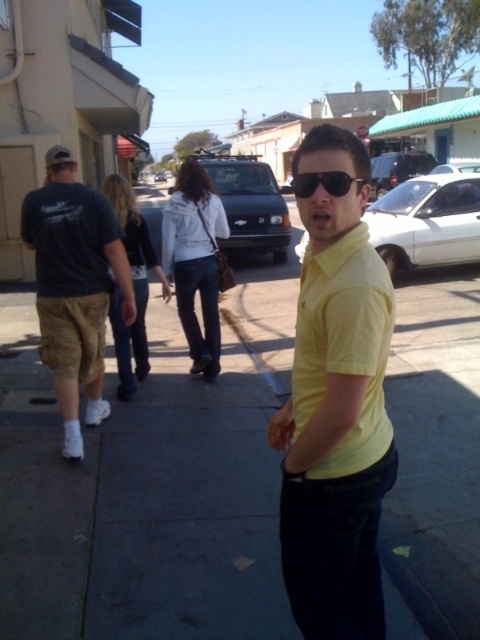
Does gray concrete sidewalk at center have a greater width compared to yellow matte shirt at center?

Indeed, gray concrete sidewalk at center has a greater width compared to yellow matte shirt at center.

Who is more forward, (x=109, y=500) or (x=284, y=406)?

Positioned in front is point (x=284, y=406).

You are a GUI agent. You are given a task and a screenshot of the screen. Output one action in this format:
    pyautogui.click(x=<x>, y=<y>)
    Task: Click on the gray concrete sidewalk at center
    The height and width of the screenshot is (640, 480).
    Given the screenshot: What is the action you would take?
    pyautogui.click(x=149, y=483)

Is gray concrete sidewalk at center smaller than dark blue t-shirt at left?

Yes, gray concrete sidewalk at center is smaller than dark blue t-shirt at left.

Does gray concrete sidewalk at center appear on the right side of dark blue t-shirt at left?

Correct, you'll find gray concrete sidewalk at center to the right of dark blue t-shirt at left.

Between point (456, 608) and point (33, 218), which one is positioned in front?

Point (456, 608) is in front.

At what (x,y) coordinates should I click in order to perform the action: click on gray concrete sidewalk at center. Please return your answer as a coordinate pair (x, y). This screenshot has height=640, width=480. Looking at the image, I should click on (149, 483).

Which is behind, point (335, 554) or point (62, 164)?

Positioned behind is point (62, 164).

Does yellow matte shirt at center have a lesser width compared to dark blue t-shirt at left?

Yes, yellow matte shirt at center is thinner than dark blue t-shirt at left.

Which is in front, point (320, 168) or point (121, 260)?

Positioned in front is point (320, 168).

Locate an element on the screen. This screenshot has width=480, height=640. yellow matte shirt at center is located at coordinates (336, 426).